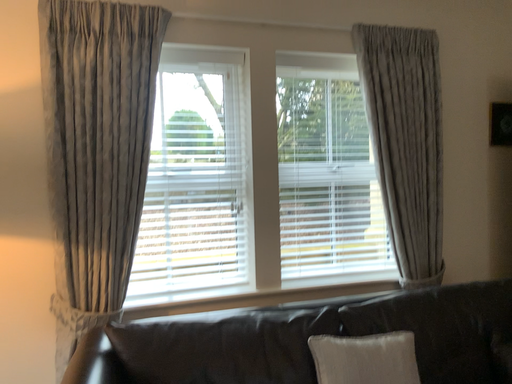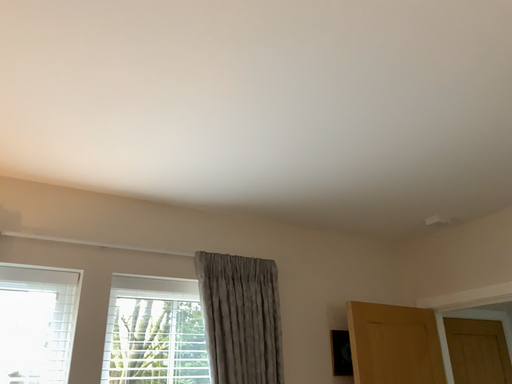
Question: How did the camera likely rotate when shooting the video?

Choices:
 (A) rotated downward
 (B) rotated upward

Answer: (B)